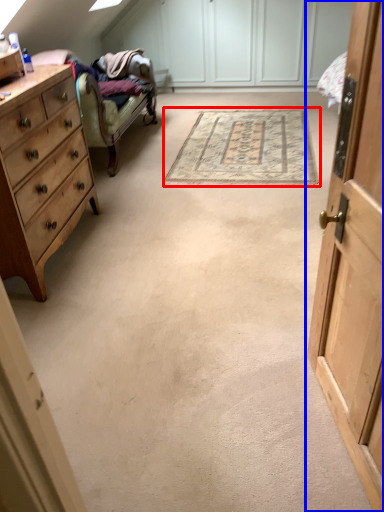
Question: Among these objects, which one is farthest to the camera, mat (highlighted by a red box) or cabinetry (highlighted by a blue box)?

Choices:
 (A) mat
 (B) cabinetry

Answer: (A)